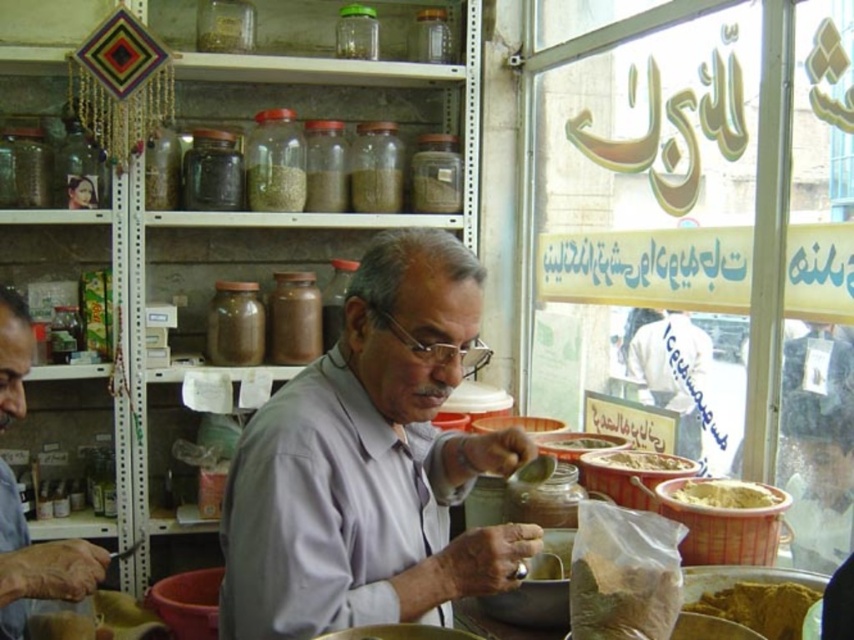
Question: Among these points, which one is farthest from the camera?

Choices:
 (A) (749, 625)
 (B) (551, 444)
 (C) (367, 180)

Answer: (C)

Question: Can you confirm if light gray shirt at center is thinner than white powdery substance at lower right?

Choices:
 (A) yes
 (B) no

Answer: (A)

Question: Can you confirm if gray matte shirt at center is bigger than light gray shirt at center?

Choices:
 (A) yes
 (B) no

Answer: (A)

Question: Based on their relative distances, which object is nearer to the translucent glass jar at upper center?

Choices:
 (A) light gray shirt at center
 (B) gray matte shirt at center
 (C) transparent glass jar at upper center
 (D) golden powder spice at center

Answer: (C)

Question: In this image, where is white powdery substance at lower right located relative to smooth brown paste at center?

Choices:
 (A) below
 (B) above

Answer: (A)

Question: Which point is farther to the camera?

Choices:
 (A) translucent glass jar at upper center
 (B) transparent glass jar at upper center
 (C) golden powder spice at center

Answer: (B)